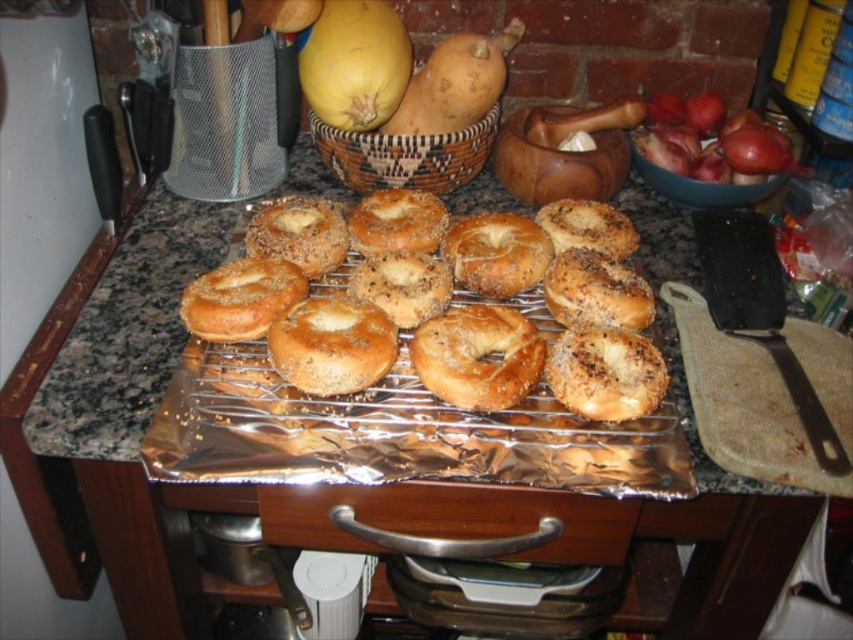
Question: Can you confirm if golden brown bagel at center is positioned below woven brown basket at upper center?

Choices:
 (A) no
 (B) yes

Answer: (B)

Question: Which point appears closest to the camera in this image?

Choices:
 (A) (346, 292)
 (B) (370, 52)

Answer: (A)

Question: Which of the following is the closest to the observer?

Choices:
 (A) yellow matte squash at upper center
 (B) woven brown basket at upper center
 (C) brown textured bagel at center

Answer: (C)

Question: Does brown textured bagel at center lie behind woven brown basket at upper center?

Choices:
 (A) yes
 (B) no

Answer: (B)

Question: Is golden brown bagel at center to the left of brown textured bagel at center from the viewer's perspective?

Choices:
 (A) no
 (B) yes

Answer: (B)

Question: Which object is the farthest from the yellow matte squash at upper center?

Choices:
 (A) golden brown bagel at center
 (B) brown textured bagel at center

Answer: (B)